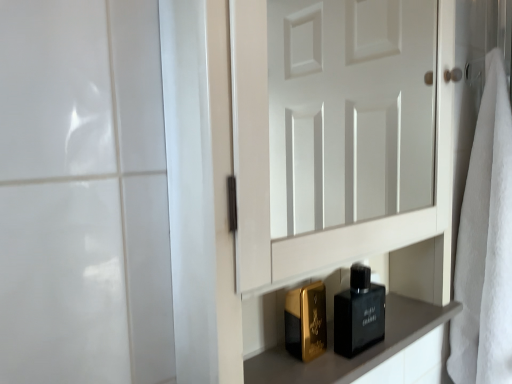
Question: Is black glass perfume at lower center facing away from white soft towel at right?

Choices:
 (A) no
 (B) yes

Answer: (A)

Question: Can you confirm if black glass perfume at lower center is positioned to the right of white soft towel at right?

Choices:
 (A) yes
 (B) no

Answer: (B)

Question: Does black glass perfume at lower center have a lesser width compared to white soft towel at right?

Choices:
 (A) no
 (B) yes

Answer: (B)

Question: From the image's perspective, does black glass perfume at lower center appear higher than white soft towel at right?

Choices:
 (A) yes
 (B) no

Answer: (B)

Question: Considering the relative sizes of black glass perfume at lower center and white soft towel at right in the image provided, is black glass perfume at lower center taller than white soft towel at right?

Choices:
 (A) no
 (B) yes

Answer: (A)

Question: From their relative heights in the image, would you say black glass perfume at lower center is taller or shorter than white soft towel at right?

Choices:
 (A) tall
 (B) short

Answer: (B)

Question: Is black glass perfume at lower center situated inside white soft towel at right or outside?

Choices:
 (A) inside
 (B) outside

Answer: (B)

Question: Is black glass perfume at lower center to the left or to the right of white soft towel at right in the image?

Choices:
 (A) left
 (B) right

Answer: (A)

Question: Is point (353, 292) positioned closer to the camera than point (456, 377)?

Choices:
 (A) farther
 (B) closer

Answer: (B)

Question: Does point (478, 195) appear closer or farther from the camera than point (420, 319)?

Choices:
 (A) farther
 (B) closer

Answer: (A)

Question: In the image, is white soft towel at right positioned in front of or behind matte black perfume bottles at lower center?

Choices:
 (A) front
 (B) behind

Answer: (B)

Question: Is white soft towel at right inside or outside of matte black perfume bottles at lower center?

Choices:
 (A) outside
 (B) inside

Answer: (A)

Question: Considering the positions of white soft towel at right and matte black perfume bottles at lower center in the image, is white soft towel at right taller or shorter than matte black perfume bottles at lower center?

Choices:
 (A) short
 (B) tall

Answer: (B)

Question: From the image's perspective, is black glass perfume at lower center above or below matte black perfume bottles at lower center?

Choices:
 (A) above
 (B) below

Answer: (A)

Question: Considering their positions, is black glass perfume at lower center located in front of or behind matte black perfume bottles at lower center?

Choices:
 (A) behind
 (B) front

Answer: (A)